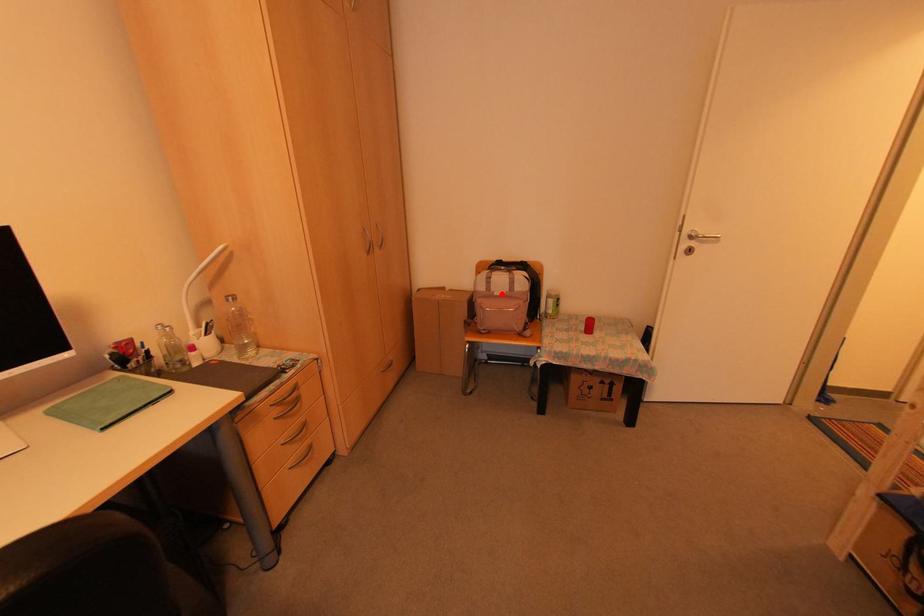
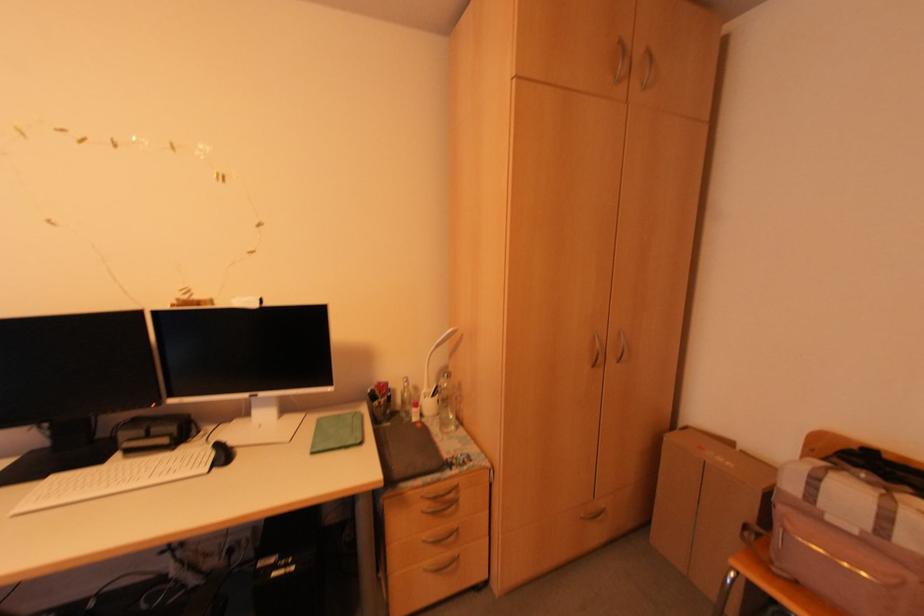
Question: I am providing you with two images of the same scene from different viewpoints. A red point is marked on the first image. Can you still see the location of the red point in image 2?

Choices:
 (A) Yes
 (B) No

Answer: (A)